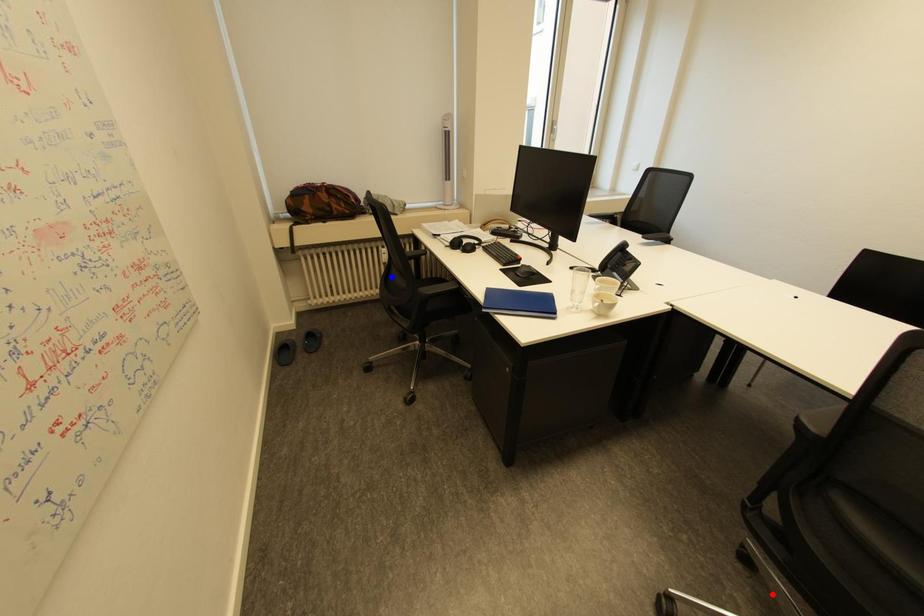
Question: In the image, two points are highlighted. Which point is nearer to the camera? Reply with the corresponding letter.

Choices:
 (A) blue point
 (B) red point

Answer: (B)